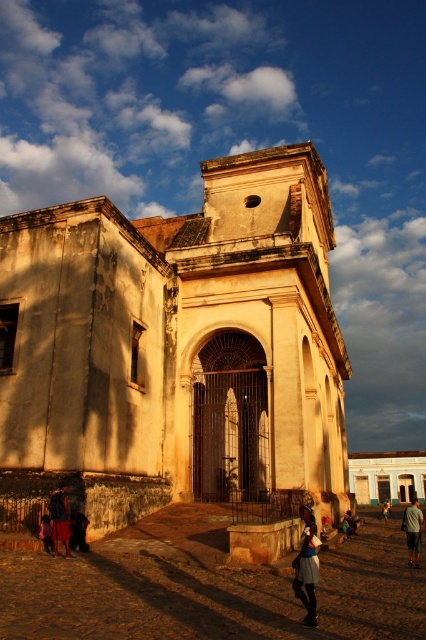
Question: Which point is farther to the camera?

Choices:
 (A) (310, 621)
 (B) (411, 525)
 (C) (60, 492)

Answer: (B)

Question: Is matte brown skirt at lower left to the left of matte red shorts at lower left from the viewer's perspective?

Choices:
 (A) yes
 (B) no

Answer: (B)

Question: Considering the real-world distances, which object is farthest from the white smooth church at center?

Choices:
 (A) yellowish plaster church at center
 (B) blue denim skirt at center
 (C) matte red shorts at lower left

Answer: (C)

Question: Which object appears farthest from the camera in this image?

Choices:
 (A) matte brown skirt at lower left
 (B) blue denim shorts at center
 (C) matte red shorts at lower left
 (D) yellowish plaster church at center

Answer: (B)

Question: Considering the relative positions of matte brown skirt at lower left and dark brown leather jacket at lower left in the image provided, where is matte brown skirt at lower left located with respect to dark brown leather jacket at lower left?

Choices:
 (A) above
 (B) below

Answer: (A)

Question: Is gray fabric shirt at lower right below blue denim skirt at center?

Choices:
 (A) yes
 (B) no

Answer: (A)